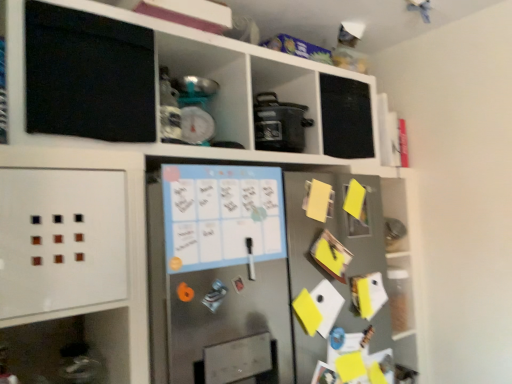
Question: From their relative heights in the image, would you say stainless steel fridge at center is taller or shorter than matte black pot at center?

Choices:
 (A) tall
 (B) short

Answer: (A)

Question: Is stainless steel fridge at center in front of or behind matte black pot at center in the image?

Choices:
 (A) front
 (B) behind

Answer: (A)

Question: Which of these objects is positioned farthest from the yellow paper at right?

Choices:
 (A) matte black pot at center
 (B) stainless steel fridge at center

Answer: (B)

Question: Estimate the real-world distances between objects in this image. Which object is farther from the matte black pot at center?

Choices:
 (A) stainless steel fridge at center
 (B) yellow paper at right

Answer: (A)